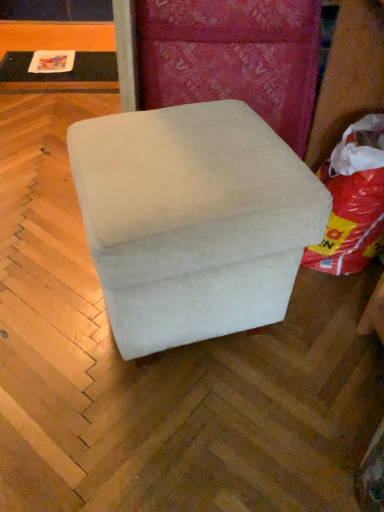
Image resolution: width=384 pixels, height=512 pixels. What are the coordinates of `free space in front of white fabric ottoman at center` in the screenshot? It's located at (168, 433).